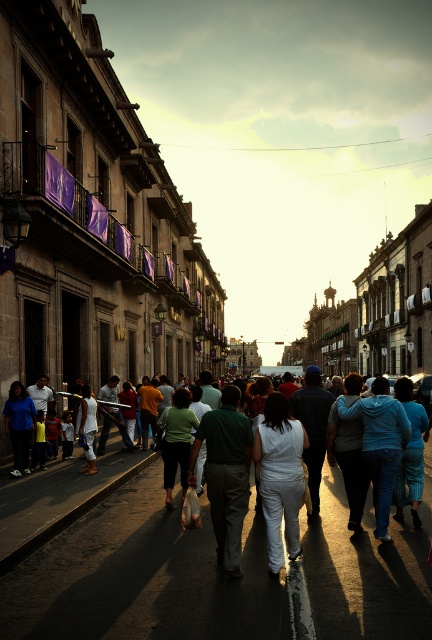
You are a photographer standing on the street and want to take a photo of the white cotton crowd at center and the white matte pants at center. Which object should you focus on first if you want to capture both in a single shot without moving the camera?

You should focus on the white cotton crowd at center first because it is located below the white matte pants at center, so adjusting the focus to the lower area will ensure both are in frame.